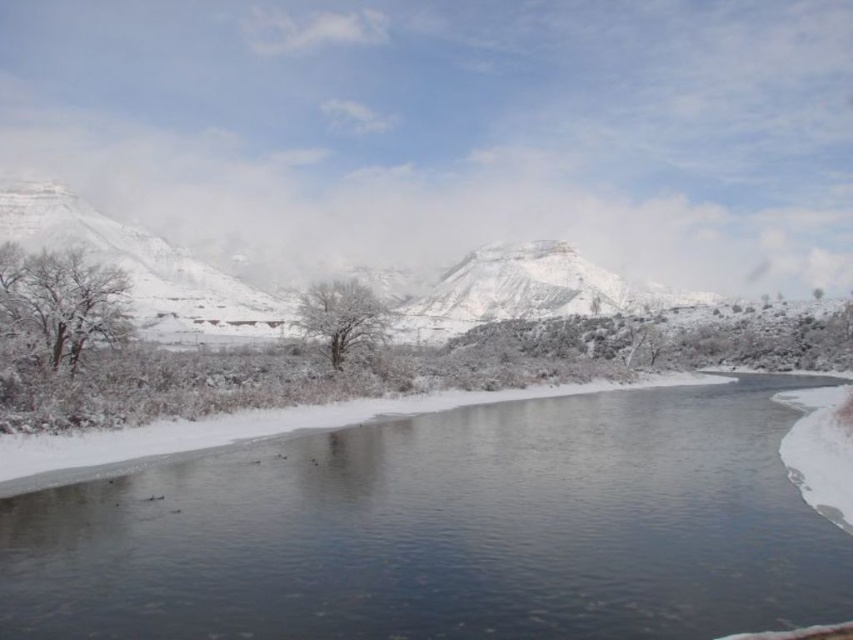
Question: Which of the following is the farthest from the observer?

Choices:
 (A) (85, 260)
 (B) (331, 321)

Answer: (B)

Question: Is snow-covered tree at left below white frosty tree at center?

Choices:
 (A) yes
 (B) no

Answer: (B)

Question: Considering the relative positions of clear ice stream at lower center and snow-covered tree at left in the image provided, where is clear ice stream at lower center located with respect to snow-covered tree at left?

Choices:
 (A) below
 (B) above

Answer: (A)

Question: Does clear ice stream at lower center have a greater width compared to white frosty tree at center?

Choices:
 (A) no
 (B) yes

Answer: (B)

Question: Which object is farther from the camera taking this photo?

Choices:
 (A) clear ice stream at lower center
 (B) white frosty tree at center

Answer: (B)

Question: Which of these objects is positioned closest to the white frosty tree at center?

Choices:
 (A) snow-covered tree at left
 (B) clear ice stream at lower center

Answer: (A)